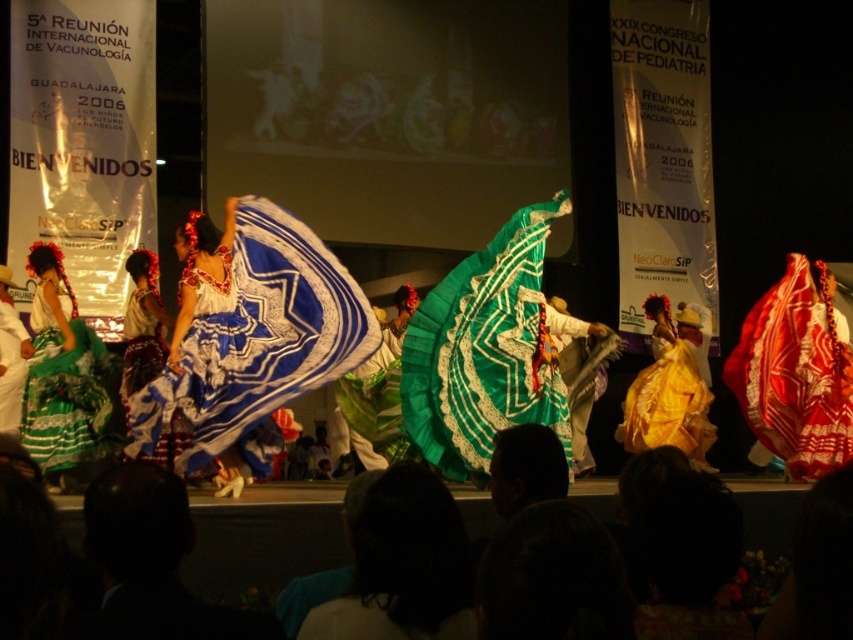
Can you confirm if green lace dress at left is thinner than yellow satin dress at center?

Correct, green lace dress at left's width is less than yellow satin dress at center's.

Image resolution: width=853 pixels, height=640 pixels. I want to click on green lace dress at left, so click(64, 376).

Where is `green lace dress at left`? green lace dress at left is located at coordinates (64, 376).

Which of these two, dark hair at lower center or matte blue fabric dress at center, stands taller?

With more height is matte blue fabric dress at center.

Can you confirm if dark hair at lower center is taller than matte blue fabric dress at center?

Incorrect, dark hair at lower center's height is not larger of matte blue fabric dress at center's.

Which is in front, point (418, 634) or point (148, 326)?

Positioned in front is point (418, 634).

The image size is (853, 640). Find the location of `dark hair at lower center`. dark hair at lower center is located at coordinates (403, 564).

Between point (352, 525) and point (55, 380), which one is positioned behind?

The point (55, 380) is more distant.

Where is `dark hair at lower center`? The image size is (853, 640). dark hair at lower center is located at coordinates (403, 564).